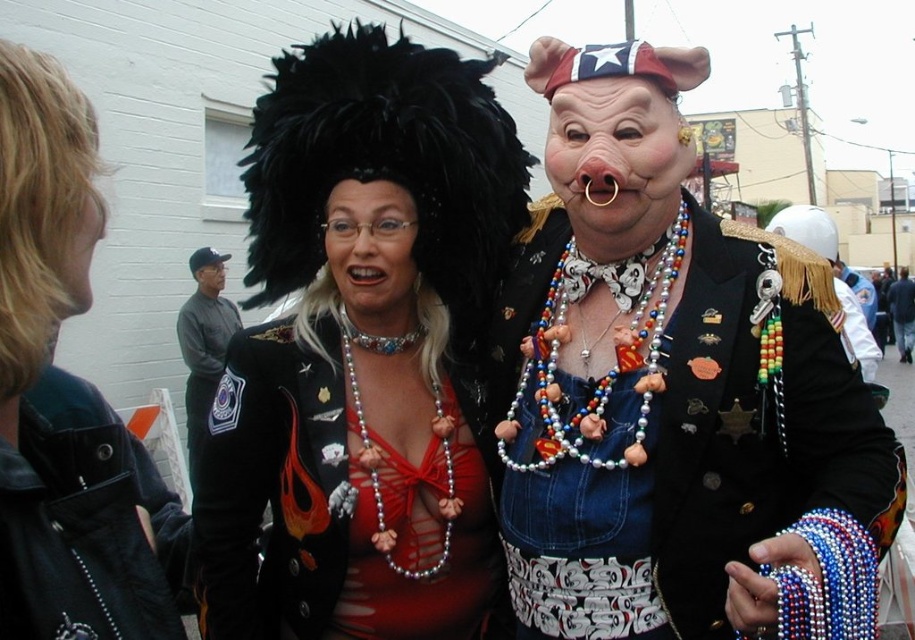
Question: Based on their relative distances, which object is farther from the beaded necklace with figurines at center?

Choices:
 (A) shiny metallic necklace at center
 (B) dark brown leather jacket at center
 (C) shiny black wig at center
 (D) blonde hair at upper left

Answer: (B)

Question: Does beaded necklace with figurines at center appear on the left side of matte plastic pig mask at center?

Choices:
 (A) yes
 (B) no

Answer: (B)

Question: In this image, where is matte plastic pig mask at center located relative to matte gray jacket at center?

Choices:
 (A) below
 (B) above

Answer: (B)

Question: Can you confirm if beaded necklace with figurines at center is thinner than matte plastic nose at center?

Choices:
 (A) yes
 (B) no

Answer: (B)

Question: Which object is the closest to the beaded necklace with figurines at center?

Choices:
 (A) shiny black leather jacket at center
 (B) blonde hair at upper left
 (C) matte black wig at upper center

Answer: (C)

Question: Which point is farther from the camera taking this photo?

Choices:
 (A) (356, 230)
 (B) (206, 285)
 (C) (648, 173)

Answer: (B)